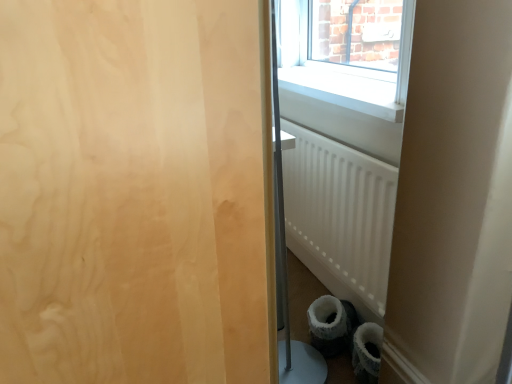
Measure the distance between point [243,372] and camera.

Point [243,372] and camera are 32.68 inches apart from each other.

This screenshot has width=512, height=384. What do you see at coordinates (135, 193) in the screenshot?
I see `matte wood screen door at center` at bounding box center [135, 193].

The height and width of the screenshot is (384, 512). Find the location of `matte wood screen door at center`. matte wood screen door at center is located at coordinates (135, 193).

Image resolution: width=512 pixels, height=384 pixels. Find the location of `matte wood screen door at center`. matte wood screen door at center is located at coordinates (135, 193).